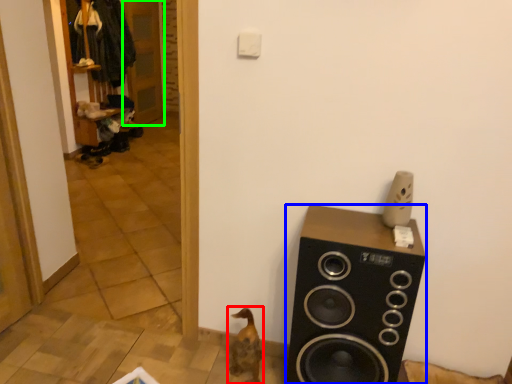
Question: Which is farther away from animal (highlighted by a red box)? speaker (highlighted by a blue box) or door (highlighted by a green box)?

Choices:
 (A) speaker
 (B) door

Answer: (B)